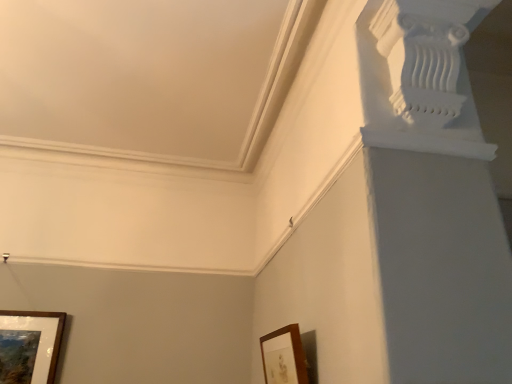
At what (x,y) coordinates should I click in order to perform the action: click on brown wooden picture frame at lower right. Please return your answer as a coordinate pair (x, y). Looking at the image, I should click on (284, 356).

This screenshot has height=384, width=512. What do you see at coordinates (284, 356) in the screenshot?
I see `brown wooden picture frame at lower right` at bounding box center [284, 356].

Identify the location of brown wooden picture frame at lower right. This screenshot has height=384, width=512. (284, 356).